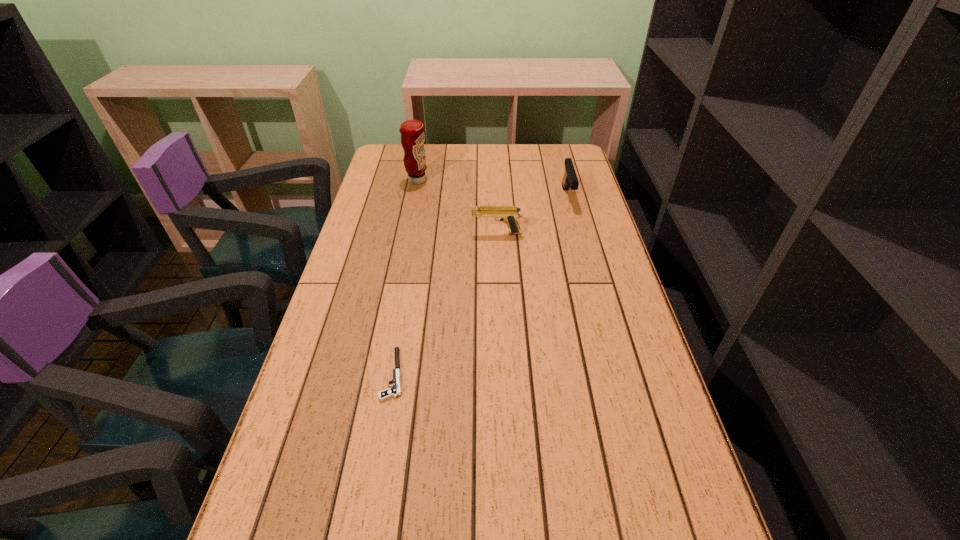
The image size is (960, 540). In order to click on blank region between the second farthest pistol and the shortest object in this screenshot , I will do `click(445, 303)`.

Identify the location of empty space that is in between the condiment and the leftmost pistol. This screenshot has height=540, width=960. tap(405, 277).

Select which object is the second closest to the nearest object. Please provide its 2D coordinates. Your answer should be formatted as a tuple, i.e. [(x, y)], where the tuple contains the x and y coordinates of a point satisfying the conditions above.

[(412, 131)]

Identify which object is the third nearest to the second pistol from left to right. Please provide its 2D coordinates. Your answer should be formatted as a tuple, i.e. [(x, y)], where the tuple contains the x and y coordinates of a point satisfying the conditions above.

[(395, 391)]

Identify which pistol is the second nearest to the rightmost pistol. Please provide its 2D coordinates. Your answer should be formatted as a tuple, i.e. [(x, y)], where the tuple contains the x and y coordinates of a point satisfying the conditions above.

[(395, 391)]

Select which pistol appears as the third closest to the tallest object. Please provide its 2D coordinates. Your answer should be formatted as a tuple, i.e. [(x, y)], where the tuple contains the x and y coordinates of a point satisfying the conditions above.

[(395, 391)]

Identify the location of free region that satisfies the following two spatial constraints: 1. on the front-facing side of the rightmost object; 2. at the barrel of the second pistol from left to right. The image size is (960, 540). (577, 233).

Locate an element on the screen. free location that satisfies the following two spatial constraints: 1. on the front-facing side of the farthest pistol; 2. on the front-facing side of the shortest pistol is located at coordinates (614, 374).

What are the coordinates of `blank area in the image that satisfies the following two spatial constraints: 1. on the front-facing side of the rightmost object; 2. at the barrel of the third farthest object` in the screenshot? It's located at (577, 233).

Identify the location of free spot that satisfies the following two spatial constraints: 1. on the front-facing side of the rightmost object; 2. at the barrel of the third farthest object. Image resolution: width=960 pixels, height=540 pixels. (577, 233).